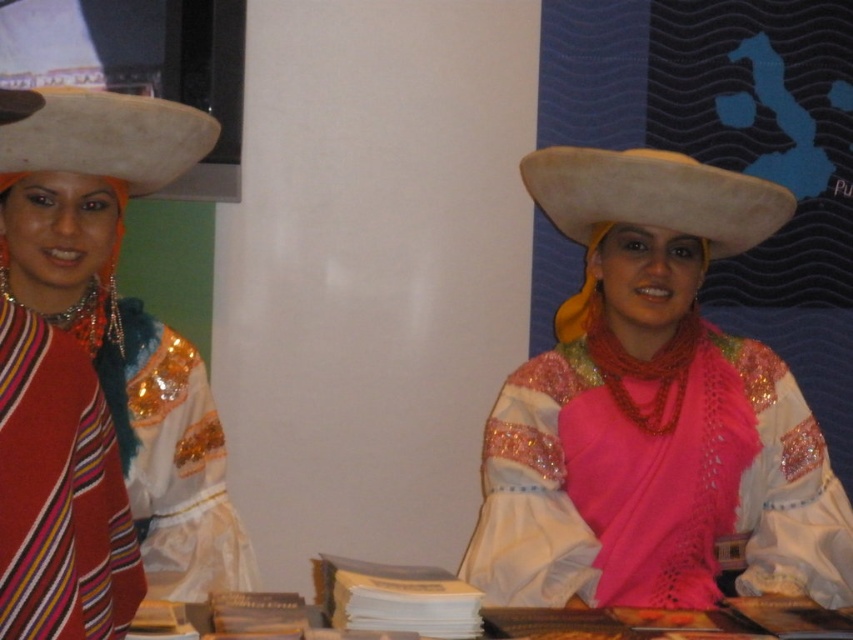
You are planning to wear a hat for an outdoor event and have both the matte white hat at center and the white felt cowboy hat at center available. Which hat would provide better sun protection based on their sizes?

The matte white hat at center provides better sun protection because it is larger in size than the white felt cowboy hat at center, offering a wider brim and more coverage from the sun.

You are a photographer setting up a shoot in a studio. You have two hats to position on a mannequin head at the center of the scene. The matte white hat at center and the white felt cowboy hat at center must be arranged so that the taller one is placed behind the shorter one to create a layered look. Which hat should you place behind the other?

The matte white hat at center is taller than the white felt cowboy hat at center, so you should place the matte white hat at center behind the white felt cowboy hat at center to achieve the layered look.